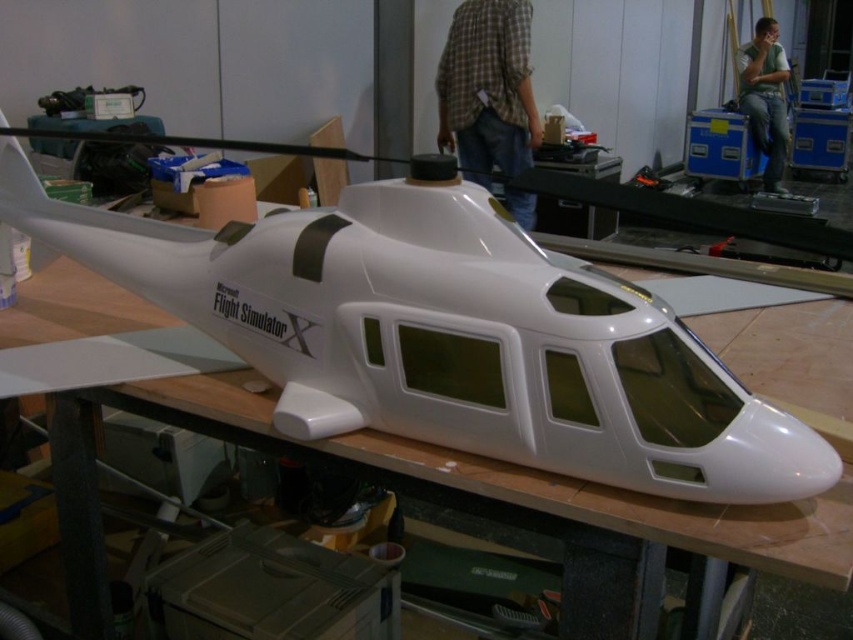
You are organizing a clothing donation drive and need to sort shirts by size. You have two shirts in front of you on the workbench, the plaid fabric shirt at upper center and the green cotton shirt at upper right. Which shirt should you place in the small size bin?

The plaid fabric shirt at upper center should be placed in the small size bin because it has a smaller size compared to the green cotton shirt at upper right.

You are an inspector checking the workshop. You see the white glossy helicopter at center and the plaid fabric shirt at upper center. Which object is nearer to you?

The white glossy helicopter at center is closer to the viewer than the plaid fabric shirt at upper center.

You are a delivery person who needs to place a green cotton shirt into a box that can only fit items narrower than the white glossy helicopter at center. Can the green cotton shirt at upper right fit in the box?

The white glossy helicopter at center might be wider than green cotton shirt at upper right, so there is uncertainty whether the green cotton shirt at upper right can fit in the box. Please check the exact width of both items.